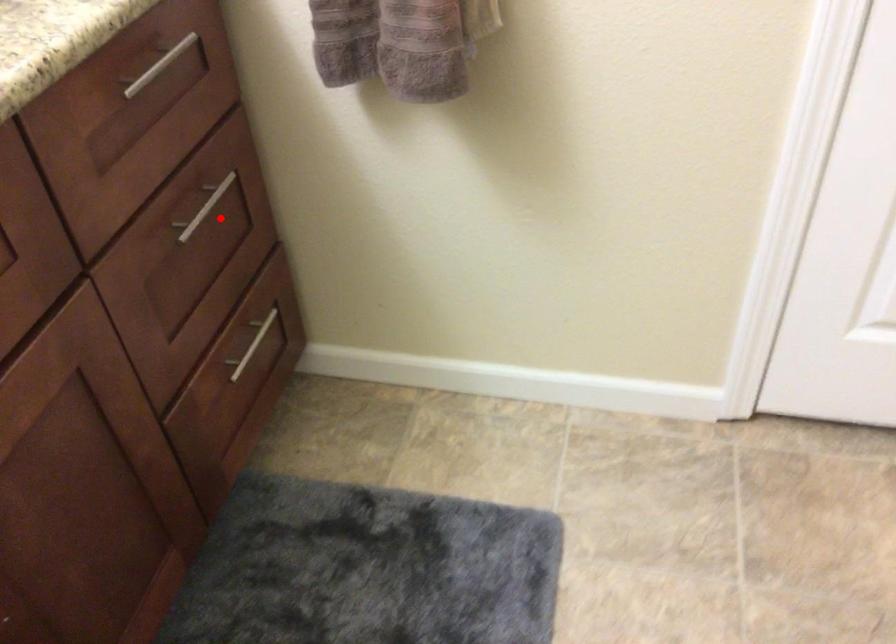
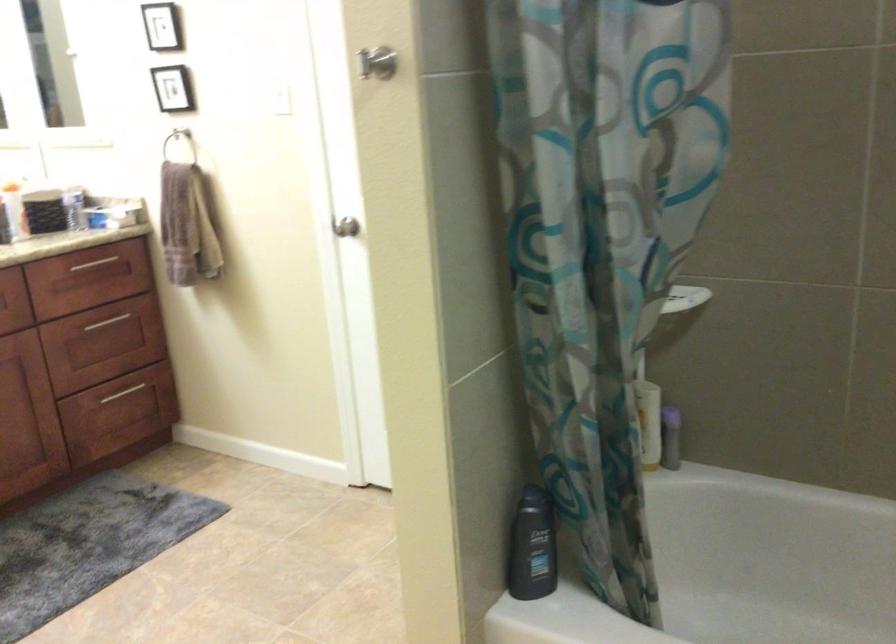
Question: I am providing you with two images of the same scene from different viewpoints. In image1, a red point is highlighted. Considering the same 3D point in image2, which of the following is correct?

Choices:
 (A) It is closer
 (B) It is farther

Answer: (B)